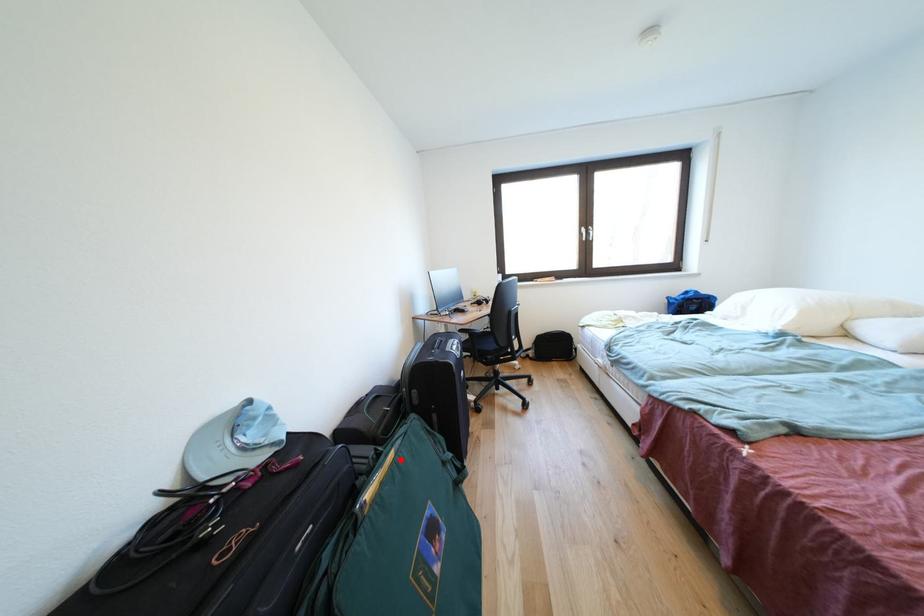
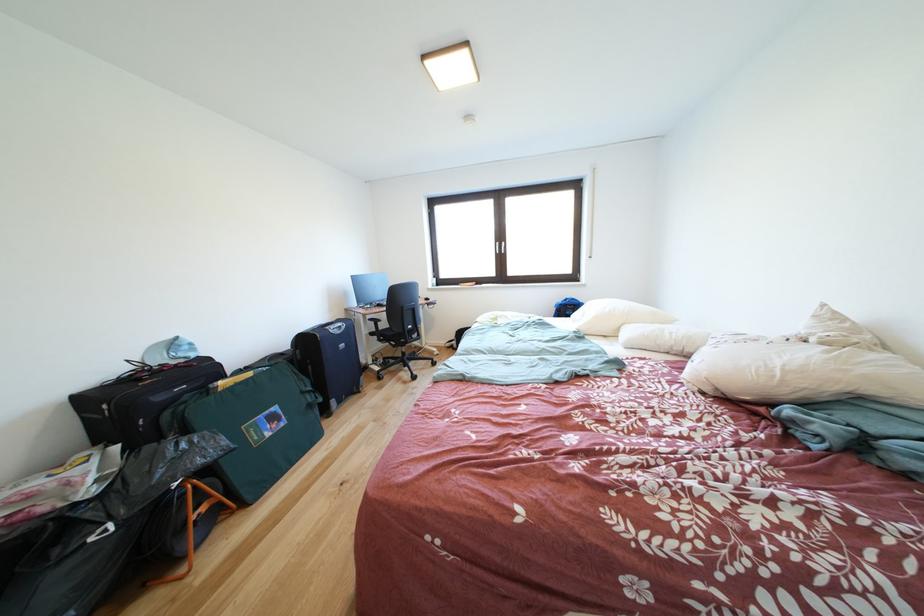
Question: A red point is marked in image1. In image2, is the corresponding 3D point closer to the camera or farther? Reply with the corresponding letter.

Choices:
 (A) The corresponding 3D point is closer.
 (B) The corresponding 3D point is farther.

Answer: (A)